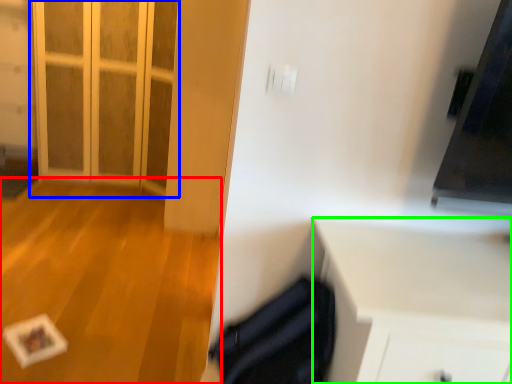
Question: Which object is the farthest from plain (highlighted by a red box)? Choose among these: door (highlighted by a blue box) or cabinetry (highlighted by a green box).

Choices:
 (A) door
 (B) cabinetry

Answer: (B)